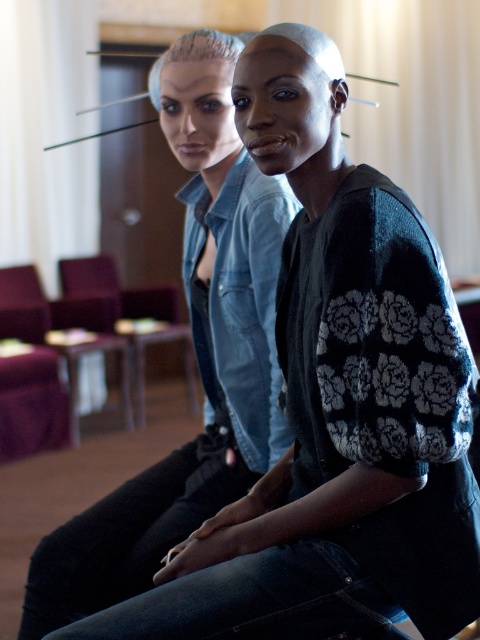
Question: Does denim jacket at center appear under purple fabric armchair at lower left?

Choices:
 (A) no
 (B) yes

Answer: (A)

Question: Estimate the real-world distances between objects in this image. Which object is farther from the purple fabric armchair at lower left?

Choices:
 (A) denim jacket at center
 (B) purple fabric armchair at center

Answer: (A)

Question: Estimate the real-world distances between objects in this image. Which object is farther from the denim jacket at center?

Choices:
 (A) purple fabric armchair at lower left
 (B) purple fabric armchair at center

Answer: (B)

Question: Observing the image, what is the correct spatial positioning of purple fabric armchair at center in reference to purple fabric armchair at lower left?

Choices:
 (A) right
 (B) left

Answer: (A)

Question: Which of the following is the farthest from the observer?

Choices:
 (A) purple fabric armchair at lower left
 (B) denim jacket at center

Answer: (A)

Question: Does denim jacket at center have a larger size compared to purple fabric armchair at center?

Choices:
 (A) no
 (B) yes

Answer: (A)